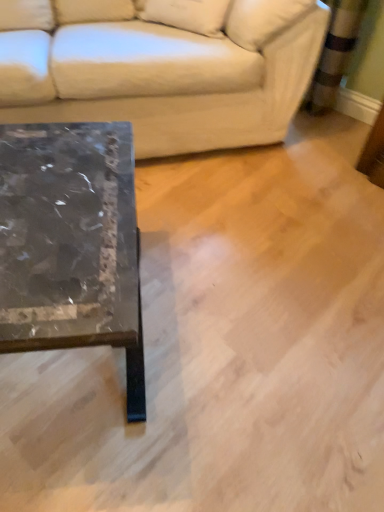
What do you see at coordinates (161, 69) in the screenshot? The height and width of the screenshot is (512, 384). I see `white leather couch at upper left` at bounding box center [161, 69].

What is the approximate width of beige fabric pillow at upper center?

It is 12.90 inches.

Identify the location of white leather couch at upper left. (161, 69).

Which is correct: marble/black at left is inside beige fabric pillow at upper center, or outside of it?

marble/black at left is located beyond the bounds of beige fabric pillow at upper center.

Does marble/black at left turn towards beige fabric pillow at upper center?

No, marble/black at left does not turn towards beige fabric pillow at upper center.

Are marble/black at left and beige fabric pillow at upper center located far from each other?

That's not correct — marble/black at left is a little close to beige fabric pillow at upper center.

Is marble/black at left looking in the opposite direction of white leather couch at upper left?

That's right, marble/black at left is facing away from white leather couch at upper left.

Which is in front, point (53, 273) or point (9, 100)?

Point (53, 273)

Would you consider marble/black at left to be distant from white leather couch at upper left?

marble/black at left is actually quite close to white leather couch at upper left.

From a real-world perspective, is marble/black at left physically located above or below white leather couch at upper left?

From a real-world perspective, marble/black at left is physically below white leather couch at upper left.

From a real-world perspective, between white leather couch at upper left and beige fabric pillow at upper center, who is vertically higher?

beige fabric pillow at upper center, from a real-world perspective.

Is white leather couch at upper left taller or shorter than beige fabric pillow at upper center?

In the image, white leather couch at upper left appears to be taller than beige fabric pillow at upper center.

From the image's perspective, who appears lower, white leather couch at upper left or beige fabric pillow at upper center?

From the image's view, white leather couch at upper left is below.

How different are the orientations of white leather couch at upper left and beige fabric pillow at upper center in degrees?

There is a 89.8-degree angle between the facing directions of white leather couch at upper left and beige fabric pillow at upper center.

From the picture: In the image, is white leather couch at upper left on the left side or the right side of marble/black at left?

Based on their positions, white leather couch at upper left is located to the right of marble/black at left.

Looking at this image, who is smaller, white leather couch at upper left or marble/black at left?

marble/black at left is smaller.

Is white leather couch at upper left positioned with its back to marble/black at left?

No, white leather couch at upper left is not facing away from marble/black at left.

From the image's perspective, is white leather couch at upper left located beneath marble/black at left?

No.

Considering the positions of objects beige fabric pillow at upper center and white leather couch at upper left in the image provided, who is more to the left, beige fabric pillow at upper center or white leather couch at upper left?

From the viewer's perspective, white leather couch at upper left appears more on the left side.

Can you confirm if beige fabric pillow at upper center is bigger than white leather couch at upper left?

Incorrect, beige fabric pillow at upper center is not larger than white leather couch at upper left.

Does point (259, 32) appear closer or farther from the camera than point (153, 151)?

Clearly, point (259, 32) is closer to the camera than point (153, 151).

Which object is thinner, beige fabric pillow at upper center or white leather couch at upper left?

beige fabric pillow at upper center is thinner.

Between beige fabric pillow at upper center and marble/black at left, which one has more height?

Standing taller between the two is marble/black at left.

Is beige fabric pillow at upper center smaller than marble/black at left?

Yes, beige fabric pillow at upper center is smaller than marble/black at left.

From a real-world perspective, is beige fabric pillow at upper center physically above marble/black at left?

Yes, from a real-world perspective, beige fabric pillow at upper center is on top of marble/black at left.

In the scene shown: Considering the positions of objects beige fabric pillow at upper center and marble/black at left in the image provided, who is in front, beige fabric pillow at upper center or marble/black at left?

marble/black at left is in front.

You are a GUI agent. You are given a task and a screenshot of the screen. Output one action in this format:
    pyautogui.click(x=<x>, y=<y>)
    Task: Click on the coffee table to the left of beige fabric pillow at upper center
    The height and width of the screenshot is (512, 384).
    Given the screenshot: What is the action you would take?
    pyautogui.click(x=71, y=243)

The height and width of the screenshot is (512, 384). In order to click on studio couch above the marble/black at left (from the image's perspective) in this screenshot , I will do `click(161, 69)`.

Which object lies nearer to the anchor point beige fabric pillow at upper center, marble/black at left or white leather couch at upper left?

Among the two, white leather couch at upper left is located nearer to beige fabric pillow at upper center.

When comparing their distances from white leather couch at upper left, does marble/black at left or beige fabric pillow at upper center seem further?

marble/black at left is positioned further to the anchor white leather couch at upper left.

When comparing their distances from beige fabric pillow at upper center, does white leather couch at upper left or marble/black at left seem further?

The object further to beige fabric pillow at upper center is marble/black at left.

Which object lies nearer to the anchor point white leather couch at upper left, beige fabric pillow at upper center or marble/black at left?

Among the two, beige fabric pillow at upper center is located nearer to white leather couch at upper left.

From the image, which object appears to be farther from marble/black at left, white leather couch at upper left or beige fabric pillow at upper center?

Based on the image, beige fabric pillow at upper center appears to be further to marble/black at left.

Looking at the image, which one is located closer to marble/black at left, beige fabric pillow at upper center or white leather couch at upper left?

A: white leather couch at upper left lies closer to marble/black at left than the other object.

Where is `studio couch between beige fabric pillow at upper center and marble/black at left in the up-down direction`? This screenshot has height=512, width=384. studio couch between beige fabric pillow at upper center and marble/black at left in the up-down direction is located at coordinates (161, 69).